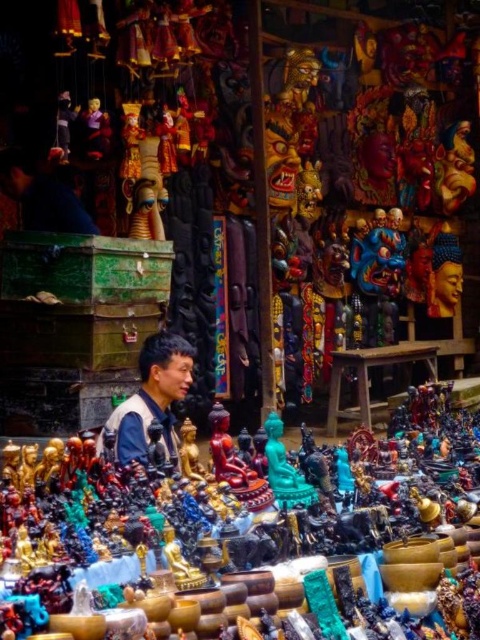
The image size is (480, 640). What do you see at coordinates (254, 522) in the screenshot?
I see `shiny gold statue at center` at bounding box center [254, 522].

Who is more distant from viewer, [416,392] or [109,416]?

Point [416,392]

Where is `shiny gold statue at center`? The image size is (480, 640). shiny gold statue at center is located at coordinates (254, 522).